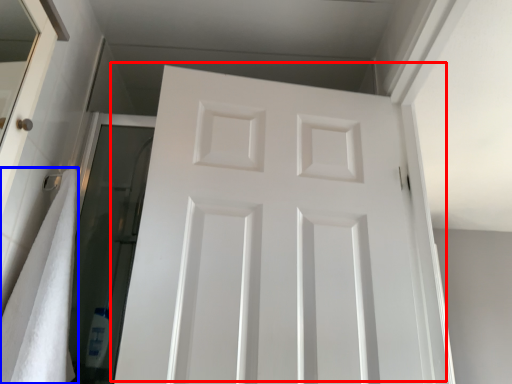
Question: Among these objects, which one is farthest to the camera, door (highlighted by a red box) or bath towel (highlighted by a blue box)?

Choices:
 (A) door
 (B) bath towel

Answer: (A)